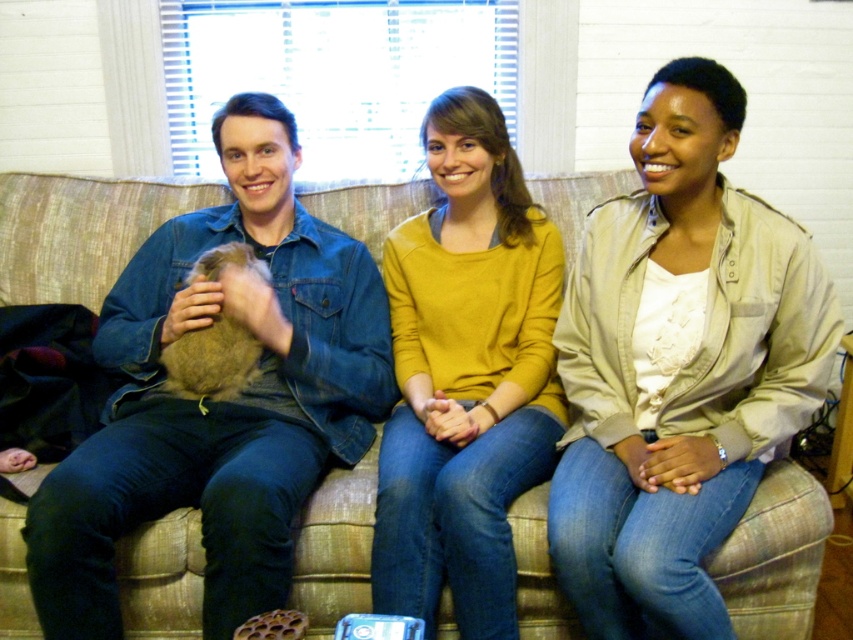
Is beige cotton jacket at center to the right of mustard yellow sweater at center from the viewer's perspective?

Indeed, beige cotton jacket at center is positioned on the right side of mustard yellow sweater at center.

Is beige cotton jacket at center positioned behind mustard yellow sweater at center?

No, it is not.

Does point (730, 448) come closer to viewer compared to point (399, 579)?

No, it is behind (399, 579).

You are a GUI agent. You are given a task and a screenshot of the screen. Output one action in this format:
    pyautogui.click(x=<x>, y=<y>)
    Task: Click on the beige cotton jacket at center
    Image resolution: width=853 pixels, height=640 pixels.
    Given the screenshot: What is the action you would take?
    click(x=677, y=368)

Is point (294, 403) more distant than point (332, 470)?

Yes, it is.

The width and height of the screenshot is (853, 640). Identify the location of denim jacket at center. (219, 403).

Does beige cotton jacket at center appear on the right side of beige fabric couch at center?

Yes, beige cotton jacket at center is to the right of beige fabric couch at center.

Is beige cotton jacket at center bigger than beige fabric couch at center?

Correct, beige cotton jacket at center is larger in size than beige fabric couch at center.

Locate an element on the screen. beige cotton jacket at center is located at coordinates 677,368.

In order to click on beige cotton jacket at center in this screenshot , I will do `click(677, 368)`.